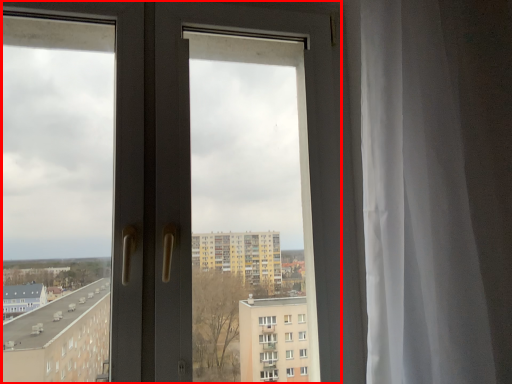
Question: From the image's perspective, what is the correct spatial relationship of door (annotated by the red box) in relation to curtain?

Choices:
 (A) above
 (B) below

Answer: (B)